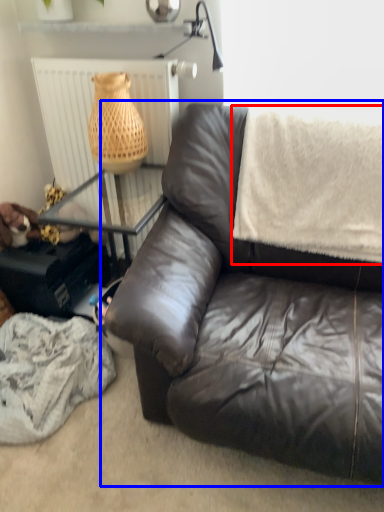
Question: Which of the following is the closest to the observer, blanket (highlighted by a red box) or studio couch (highlighted by a blue box)?

Choices:
 (A) blanket
 (B) studio couch

Answer: (B)